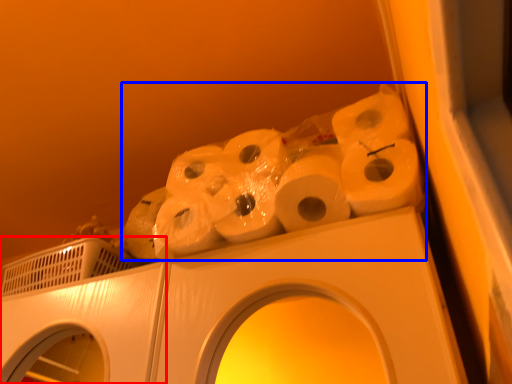
Question: Which object appears closest to the camera in this image, washing machine (highlighted by a red box) or toilet paper (highlighted by a blue box)?

Choices:
 (A) washing machine
 (B) toilet paper

Answer: (B)